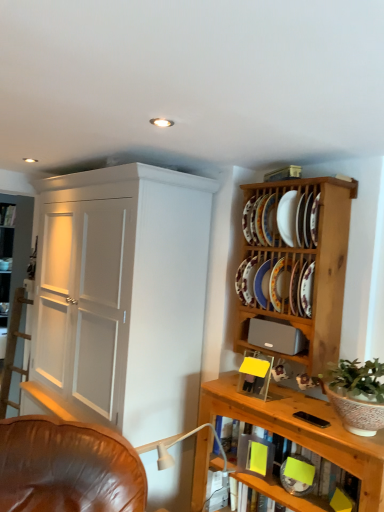
How much space does matte ceramic platter at upper right, positioned as the 3th platter in top-to-bottom order, occupy vertically?

10.75 inches.

The width and height of the screenshot is (384, 512). Describe the element at coordinates (302, 431) in the screenshot. I see `wooden shelf at lower right, marked as the 1th shelf in a bottom-to-top arrangement` at that location.

The height and width of the screenshot is (512, 384). What are the coordinates of `gray matte speaker at upper right` in the screenshot? It's located at (x=271, y=336).

What are the coordinates of `white ceramic plate at upper right` in the screenshot? It's located at (288, 217).

The width and height of the screenshot is (384, 512). What do you see at coordinates (288, 217) in the screenshot? I see `white ceramic plate at upper right` at bounding box center [288, 217].

This screenshot has height=512, width=384. I want to click on white painted wood cupboard at left, so click(x=123, y=296).

Image resolution: width=384 pixels, height=512 pixels. What are the coordinates of `porcelain plate at upper right, placed as the fourth platter when sorted from top to bottom` in the screenshot? It's located at (261, 283).

Considering the sizes of objects wooden shelf at lower right, marked as the 1th shelf in a bottom-to-top arrangement, and white glossy plate at upper right, which is the 4th platter in bottom-to-top order, in the image provided, who is thinner, wooden shelf at lower right, marked as the 1th shelf in a bottom-to-top arrangement, or white glossy plate at upper right, which is the 4th platter in bottom-to-top order,?

Thinner between the two is white glossy plate at upper right, which is the 4th platter in bottom-to-top order.

Relative to white glossy plate at upper right, which ranks as the second platter in top-to-bottom order, is wooden shelf at lower right, marked as the 1th shelf in a bottom-to-top arrangement, in front or behind?

In the image, wooden shelf at lower right, marked as the 1th shelf in a bottom-to-top arrangement, appears in front of white glossy plate at upper right, which ranks as the second platter in top-to-bottom order.

Measure the distance between wooden shelf at lower right, placed as the second shelf when sorted from top to bottom, and white glossy plate at upper right, which is the 4th platter in bottom-to-top order.

wooden shelf at lower right, placed as the second shelf when sorted from top to bottom, is 33.88 inches away from white glossy plate at upper right, which is the 4th platter in bottom-to-top order.

From the image's perspective, does wooden shelf at lower right, marked as the 1th shelf in a bottom-to-top arrangement, appear higher than white glossy plate at upper right, which ranks as the second platter in top-to-bottom order?

No, from the image's perspective, wooden shelf at lower right, marked as the 1th shelf in a bottom-to-top arrangement, is not above white glossy plate at upper right, which ranks as the second platter in top-to-bottom order.

Is white ceramic plate at upper right bigger or smaller than matte ceramic platter at upper right, positioned as the 3th platter in top-to-bottom order?

In the image, white ceramic plate at upper right appears to be smaller than matte ceramic platter at upper right, positioned as the 3th platter in top-to-bottom order.

Between white ceramic plate at upper right and matte ceramic platter at upper right, positioned as the 3th platter in top-to-bottom order, which one has less height?

white ceramic plate at upper right is shorter.

Is point (289, 224) closer to camera compared to point (245, 294)?

That is True.

In the image, is wooden plate rack at upper right, which is counted as the 1th shelf, starting from the top, positioned in front of or behind wooden shelf at lower right, marked as the 1th shelf in a bottom-to-top arrangement?

wooden plate rack at upper right, which is counted as the 1th shelf, starting from the top, is behind wooden shelf at lower right, marked as the 1th shelf in a bottom-to-top arrangement.

From a real-world perspective, does wooden plate rack at upper right, which is counted as the 2th shelf, starting from the bottom, sit lower than wooden shelf at lower right, marked as the 1th shelf in a bottom-to-top arrangement?

Incorrect, from a real-world perspective, wooden plate rack at upper right, which is counted as the 2th shelf, starting from the bottom, is higher than wooden shelf at lower right, marked as the 1th shelf in a bottom-to-top arrangement.

Between wooden plate rack at upper right, which is counted as the 1th shelf, starting from the top, and wooden shelf at lower right, placed as the second shelf when sorted from top to bottom, which one has larger size?

wooden plate rack at upper right, which is counted as the 1th shelf, starting from the top.

Is white painted wood cupboard at left turned away from porcelain plate at upper right, the 2th platter when ordered from bottom to top?

white painted wood cupboard at left does not have its back to porcelain plate at upper right, the 2th platter when ordered from bottom to top.

Considering the sizes of white painted wood cupboard at left and porcelain plate at upper right, placed as the fourth platter when sorted from top to bottom, in the image, is white painted wood cupboard at left bigger or smaller than porcelain plate at upper right, placed as the fourth platter when sorted from top to bottom,?

white painted wood cupboard at left is bigger than porcelain plate at upper right, placed as the fourth platter when sorted from top to bottom.

Which is correct: white painted wood cupboard at left is inside porcelain plate at upper right, the 2th platter when ordered from bottom to top, or outside of it?

white painted wood cupboard at left is located beyond the bounds of porcelain plate at upper right, the 2th platter when ordered from bottom to top.

Is white painted wood cupboard at left to the left of porcelain plate at upper right, placed as the fourth platter when sorted from top to bottom, from the viewer's perspective?

Yes.

Is matte ceramic platter at upper right, the third platter when ordered from bottom to top, wider or thinner than wooden shelf at lower right, placed as the second shelf when sorted from top to bottom?

Clearly, matte ceramic platter at upper right, the third platter when ordered from bottom to top, has more width compared to wooden shelf at lower right, placed as the second shelf when sorted from top to bottom.

From a real-world perspective, between matte ceramic platter at upper right, the third platter when ordered from bottom to top, and wooden shelf at lower right, marked as the 1th shelf in a bottom-to-top arrangement, who is vertically lower?

wooden shelf at lower right, marked as the 1th shelf in a bottom-to-top arrangement, from a real-world perspective.

Measure the distance from matte ceramic platter at upper right, positioned as the 3th platter in top-to-bottom order, to wooden shelf at lower right, placed as the second shelf when sorted from top to bottom.

matte ceramic platter at upper right, positioned as the 3th platter in top-to-bottom order, is 20.34 inches away from wooden shelf at lower right, placed as the second shelf when sorted from top to bottom.

Is matte ceramic platter at upper right, positioned as the 3th platter in top-to-bottom order, outside of wooden shelf at lower right, placed as the second shelf when sorted from top to bottom?

That's correct, matte ceramic platter at upper right, positioned as the 3th platter in top-to-bottom order, is outside of wooden shelf at lower right, placed as the second shelf when sorted from top to bottom.

Is wooden plate rack at upper right, which is counted as the 2th shelf, starting from the bottom, at the left side of white painted wood cupboard at left?

No.

Which shelf is the 2nd one when counting from the right side of the white painted wood cupboard at left? Please provide its 2D coordinates.

[(304, 268)]

From a real-world perspective, which is physically below, wooden plate rack at upper right, which is counted as the 2th shelf, starting from the bottom, or white painted wood cupboard at left?

From a 3D spatial view, white painted wood cupboard at left is below.

From a real-world perspective, is white ceramic plate at upper right below porcelain plate at upper right, the 2th platter when ordered from bottom to top?

Actually, white ceramic plate at upper right is physically above porcelain plate at upper right, the 2th platter when ordered from bottom to top, in the real world.

Measure the distance between white ceramic plate at upper right and porcelain plate at upper right, the 2th platter when ordered from bottom to top.

They are 26.71 centimeters apart.

Locate an element on the screen. the 2nd platter to the left of the white ceramic plate at upper right, counting from the anchor's position is located at coordinates (261, 283).

Can you confirm if white ceramic plate at upper right is taller than porcelain plate at upper right, placed as the fourth platter when sorted from top to bottom?

Correct, white ceramic plate at upper right is much taller as porcelain plate at upper right, placed as the fourth platter when sorted from top to bottom.

From a real-world perspective, starting from the wooden shelf at lower right, marked as the 1th shelf in a bottom-to-top arrangement, which platter is the 4th one vertically above it? Please provide its 2D coordinates.

[(270, 221)]

The height and width of the screenshot is (512, 384). In order to click on plate that is above the matte ceramic platter at upper right, positioned as the 3th platter in top-to-bottom order (from the image's perspective) in this screenshot , I will do `click(288, 217)`.

Looking at the image, which one is located further to white glossy plate at upper right, which ranks as the second platter in top-to-bottom order, matte ceramic platter at upper right, positioned as the 3th platter in top-to-bottom order, or gray matte speaker at upper right?

gray matte speaker at upper right lies further to white glossy plate at upper right, which ranks as the second platter in top-to-bottom order, than the other object.

Based on their spatial positions, is white painted wood cupboard at left or porcelain plate at upper right, which ranks as the fifth platter in top-to-bottom order, further from porcelain plate at upper right, placed as the fourth platter when sorted from top to bottom?

The object further to porcelain plate at upper right, placed as the fourth platter when sorted from top to bottom, is white painted wood cupboard at left.

Considering their positions, is porcelain plate at upper right, placed as the fourth platter when sorted from top to bottom, positioned closer to matte ceramic platter at upper right, positioned as the 3th platter in top-to-bottom order, than white ceramic plate at upper right?

porcelain plate at upper right, placed as the fourth platter when sorted from top to bottom, is positioned closer to the anchor matte ceramic platter at upper right, positioned as the 3th platter in top-to-bottom order.

Considering their positions, is gray matte speaker at upper right positioned further to white ceramic plate at upper right than wooden plate rack at upper right, which is counted as the 1th shelf, starting from the top?

gray matte speaker at upper right is positioned further to the anchor white ceramic plate at upper right.

Considering their positions, is green leafy plant in textured ceramic pot at right positioned further to white glossy plate at upper right, which ranks as the second platter in top-to-bottom order, than wooden plate rack at upper right, which is counted as the 2th shelf, starting from the bottom?

green leafy plant in textured ceramic pot at right.

From the image, which object appears to be farther from porcelain plate at upper right, acting as the 1th platter starting from the bottom, gray matte speaker at upper right or white ceramic plate at upper right?

Based on the image, white ceramic plate at upper right appears to be further to porcelain plate at upper right, acting as the 1th platter starting from the bottom.

Consider the image. Considering their positions, is porcelain plate at upper right, placed as the fourth platter when sorted from top to bottom, positioned further to porcelain plate at upper right, arranged as the first platter when viewed from the top, than green leafy plant in textured ceramic pot at right?

green leafy plant in textured ceramic pot at right is further to porcelain plate at upper right, arranged as the first platter when viewed from the top.

Based on their spatial positions, is porcelain plate at upper right, acting as the 1th platter starting from the bottom, or green leafy plant in textured ceramic pot at right closer to gray matte speaker at upper right?

porcelain plate at upper right, acting as the 1th platter starting from the bottom, is positioned closer to the anchor gray matte speaker at upper right.

Image resolution: width=384 pixels, height=512 pixels. I want to click on shelf between white ceramic plate at upper right and porcelain plate at upper right, placed as the fourth platter when sorted from top to bottom, in the up-down direction, so click(x=304, y=268).

What are the coordinates of `plate between wooden plate rack at upper right, which is counted as the 2th shelf, starting from the bottom, and porcelain plate at upper right, arranged as the 5th platter when ordered from the bottom, from front to back` in the screenshot? It's located at (288, 217).

The image size is (384, 512). Find the location of `plate between white glossy plate at upper right, which ranks as the second platter in top-to-bottom order, and porcelain plate at upper right, which ranks as the fifth platter in top-to-bottom order, vertically`. plate between white glossy plate at upper right, which ranks as the second platter in top-to-bottom order, and porcelain plate at upper right, which ranks as the fifth platter in top-to-bottom order, vertically is located at coordinates (288, 217).

Locate an element on the screen. The width and height of the screenshot is (384, 512). shelf between white ceramic plate at upper right and gray matte speaker at upper right in the up-down direction is located at coordinates (304, 268).